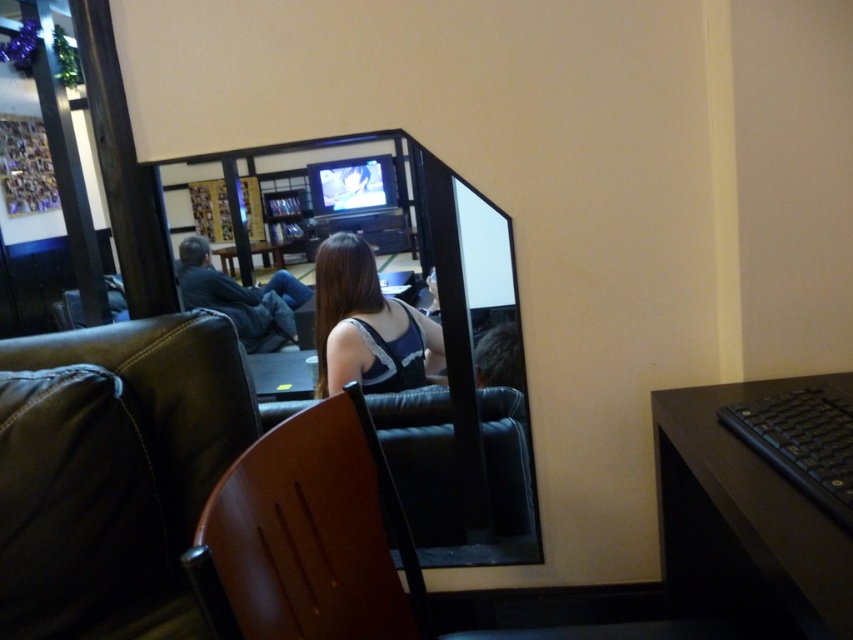
Question: Which point appears farthest from the camera in this image?

Choices:
 (A) (682, 516)
 (B) (206, 545)

Answer: (A)

Question: Which is farther from the black matte table at lower right?

Choices:
 (A) satin black top at center
 (B) brown leather chair at center

Answer: (A)

Question: Does black matte table at lower right appear on the left side of wooden table at center?

Choices:
 (A) yes
 (B) no

Answer: (B)

Question: Observing the image, what is the correct spatial positioning of leather couch at lower left in reference to matte black tv at upper center?

Choices:
 (A) left
 (B) right

Answer: (B)

Question: Among these objects, which one is nearest to the camera?

Choices:
 (A) leather couch at lower left
 (B) brown leather chair at center
 (C) matte black tv at upper center
 (D) black matte table at lower right

Answer: (D)

Question: Is leather couch at lower left above dark blue jeans at left?

Choices:
 (A) yes
 (B) no

Answer: (B)